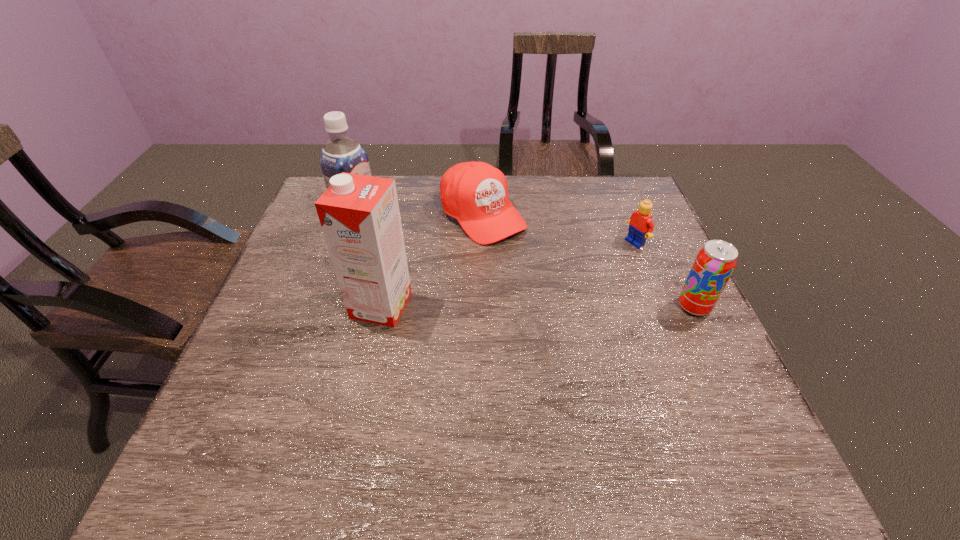
Find the location of a particular element. The width and height of the screenshot is (960, 540). free location that satisfies the following two spatial constraints: 1. on the back side of the carton; 2. on the left side of the baseball cap is located at coordinates (401, 215).

Where is `free space that satisfies the following two spatial constraints: 1. on the front side of the third tallest object; 2. on the left side of the soya milk`? The height and width of the screenshot is (540, 960). free space that satisfies the following two spatial constraints: 1. on the front side of the third tallest object; 2. on the left side of the soya milk is located at coordinates (337, 307).

Find the location of a particular element. vacant point that satisfies the following two spatial constraints: 1. on the front side of the third tallest object; 2. on the left side of the carton is located at coordinates (381, 307).